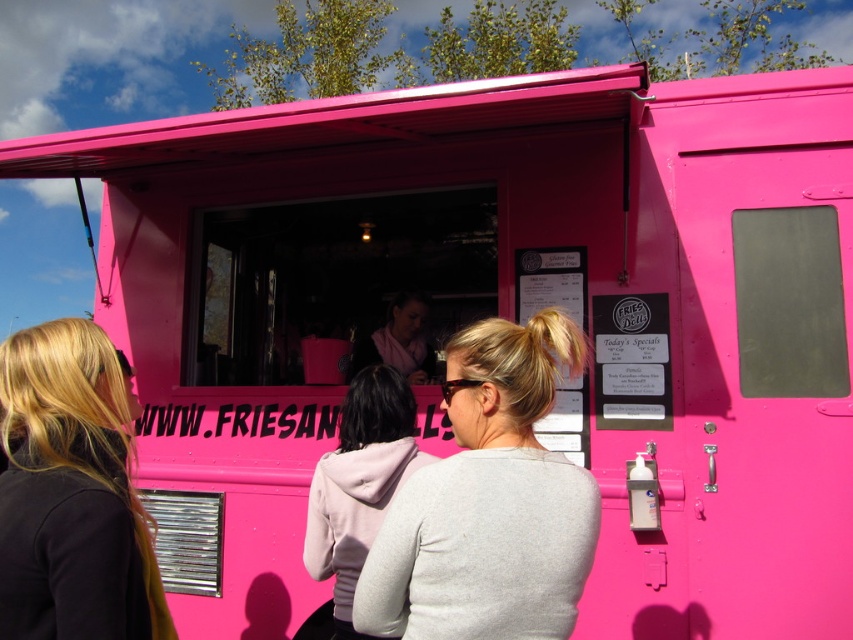
Question: Which of the following is the farthest from the observer?

Choices:
 (A) [x=20, y=378]
 (B) [x=335, y=483]
 (C) [x=577, y=552]

Answer: (B)

Question: Is the position of matte gray sweater at center more distant than that of black matte hair at left?

Choices:
 (A) no
 (B) yes

Answer: (B)

Question: Is matte gray sweater at center above black matte hair at left?

Choices:
 (A) yes
 (B) no

Answer: (B)

Question: Among these objects, which one is nearest to the camera?

Choices:
 (A) pink fleece hoodie at center
 (B) black matte hair at left
 (C) matte gray sweater at center

Answer: (B)

Question: Does matte gray sweater at center come behind black matte hair at left?

Choices:
 (A) no
 (B) yes

Answer: (B)

Question: Which point appears closest to the camera in this image?

Choices:
 (A) (422, 637)
 (B) (115, 508)
 (C) (311, 512)

Answer: (B)